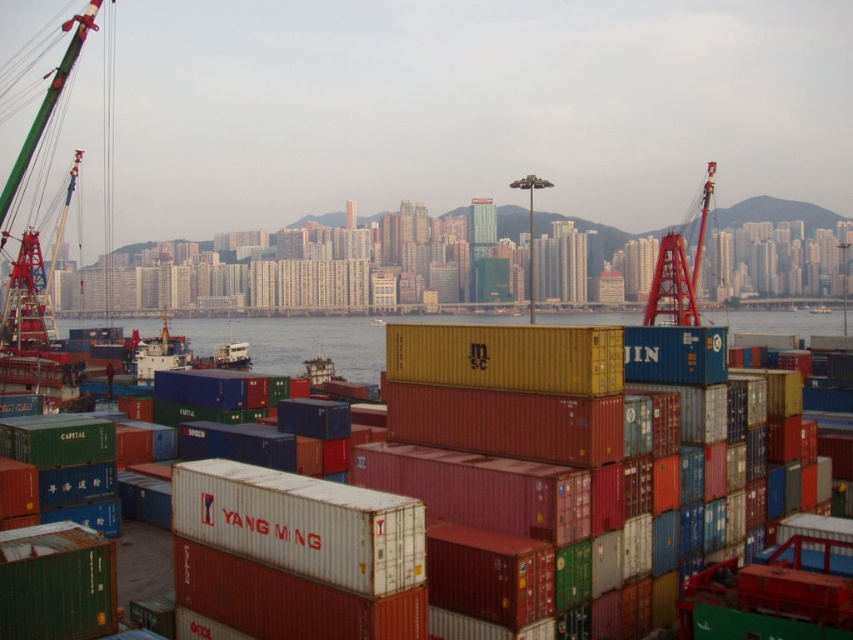
You are a photographer trying to capture the entire scene of the port. You notice the blue water at center and the red metallic crane at right. Which object would appear bigger in your photo?

The blue water at center would appear bigger in the photo since it has a larger size compared to the red metallic crane at right.

You are a drone operator trying to capture a photo of the port scene. The drone is currently at the top of the image. To get the best shot of the blue water at center, should you move the drone upwards or downwards?

The blue water at center is located at point (294, 340), which is closer to the bottom half of the image. Since the drone is at the top, you should move it downward to capture the blue water at center effectively.

You are a port worker who needs to navigate from the blue water at center to the red metallic crane at right. Which direction should you move to reach the crane?

The blue water at center is positioned on the left side of the red metallic crane at right, so you should move to the right to reach the crane.